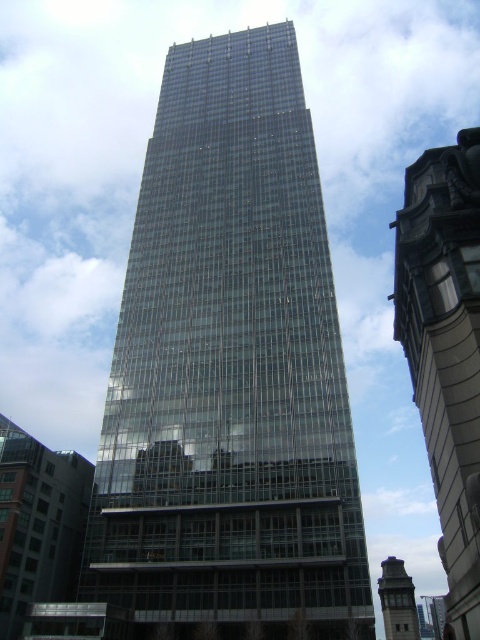
Question: Can you confirm if glassy steel skyscraper at center is positioned to the right of gray concrete clock tower at lower right?

Choices:
 (A) yes
 (B) no

Answer: (B)

Question: Does transparent glass tower at center come behind gray concrete clock tower at lower right?

Choices:
 (A) yes
 (B) no

Answer: (B)

Question: Which object is farther from the camera taking this photo?

Choices:
 (A) gray concrete clock tower at lower right
 (B) transparent glass tower at center

Answer: (A)

Question: Which point is farther to the camera?

Choices:
 (A) (188, 481)
 (B) (477, 144)
 (C) (58, 470)
 (D) (400, 604)

Answer: (D)

Question: Considering the real-world distances, which object is farthest from the gray concrete clock tower at lower right?

Choices:
 (A) glassy steel skyscraper at center
 (B) transparent glass tower at center

Answer: (B)

Question: Does transparent glass building at center have a greater width compared to gray concrete clock tower at lower right?

Choices:
 (A) yes
 (B) no

Answer: (B)